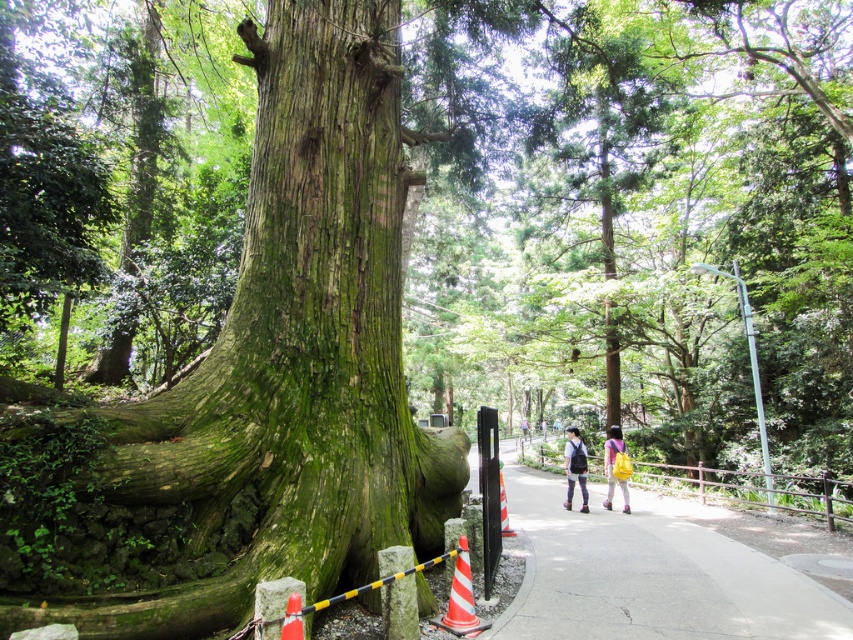
Question: Is smooth concrete pavement at center below matte black backpack at center?

Choices:
 (A) no
 (B) yes

Answer: (A)

Question: Which point is farther to the camera?

Choices:
 (A) (16, 424)
 (B) (578, 483)

Answer: (B)

Question: Is smooth concrete pavement at center further to camera compared to matte black backpack at center?

Choices:
 (A) no
 (B) yes

Answer: (A)

Question: Does matte black backpack at center have a greater width compared to yellow backpack at center?

Choices:
 (A) no
 (B) yes

Answer: (B)

Question: Which is nearer to the matte black backpack at center?

Choices:
 (A) smooth concrete pavement at center
 (B) green rough bark tree trunk at center
 (C) yellow backpack at center

Answer: (C)

Question: Which object is positioned farthest from the matte black backpack at center?

Choices:
 (A) smooth concrete pavement at center
 (B) yellow backpack at center

Answer: (A)